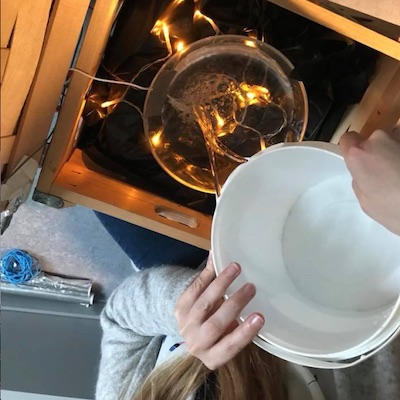
Locate an element on the screen. This screenshot has height=400, width=400. wooden crate is located at coordinates (111, 200).